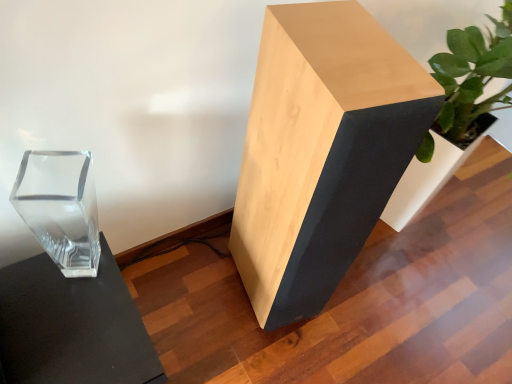
What do you see at coordinates (321, 151) in the screenshot?
I see `natural wood/black speaker at center` at bounding box center [321, 151].

Measure the distance between natural wood/black speaker at center and camera.

natural wood/black speaker at center is 26.84 inches from camera.

Identify the location of natural wood/black speaker at center. This screenshot has height=384, width=512. click(321, 151).

What are the coordinates of `natural wood/black speaker at center` in the screenshot? It's located at (321, 151).